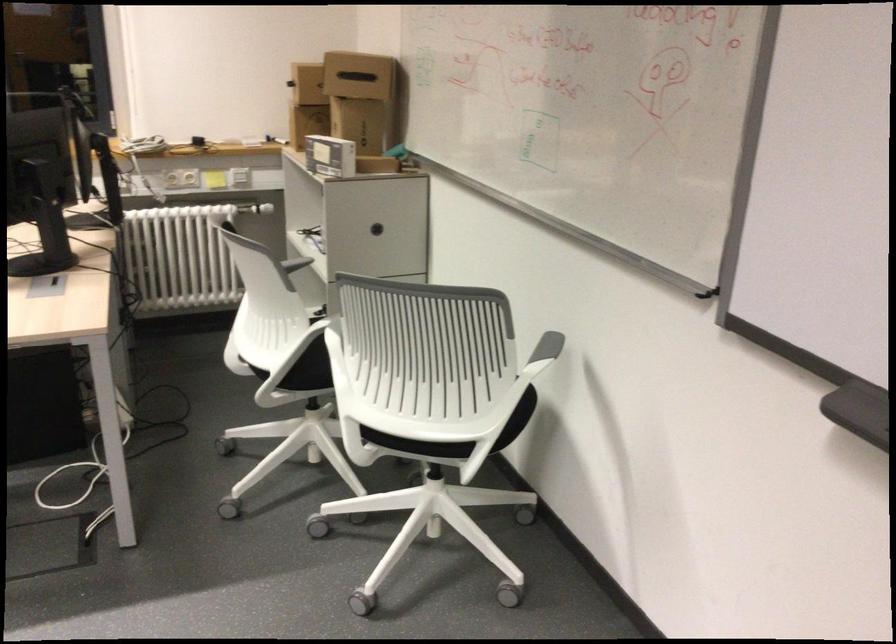
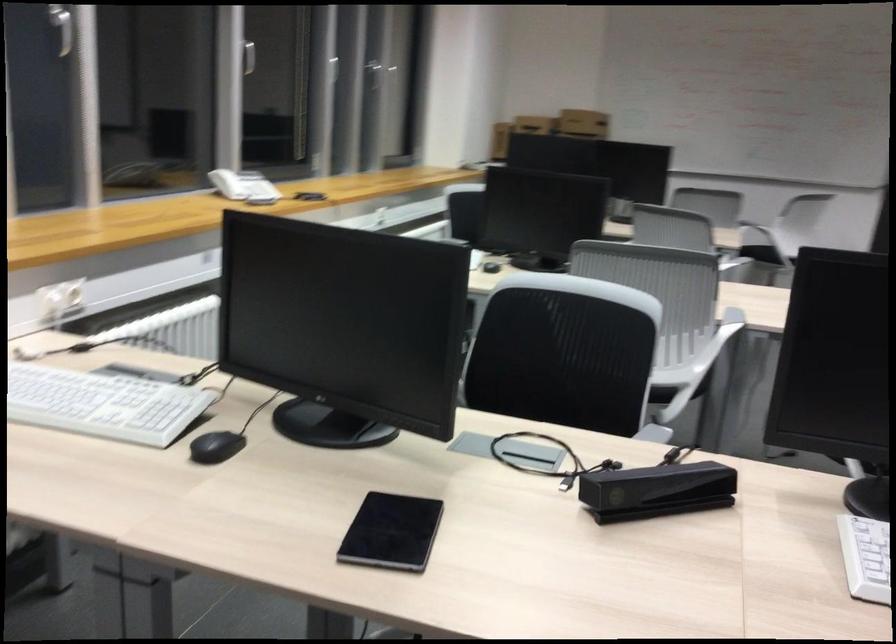
Question: I am providing you with two images of the same scene from different viewpoints. Please identify which objects are invisible in image2.

Choices:
 (A) box handle slot
 (B) chair sitting surface
 (C) black sensor device
 (D) mirrored cabinet door

Answer: (A)